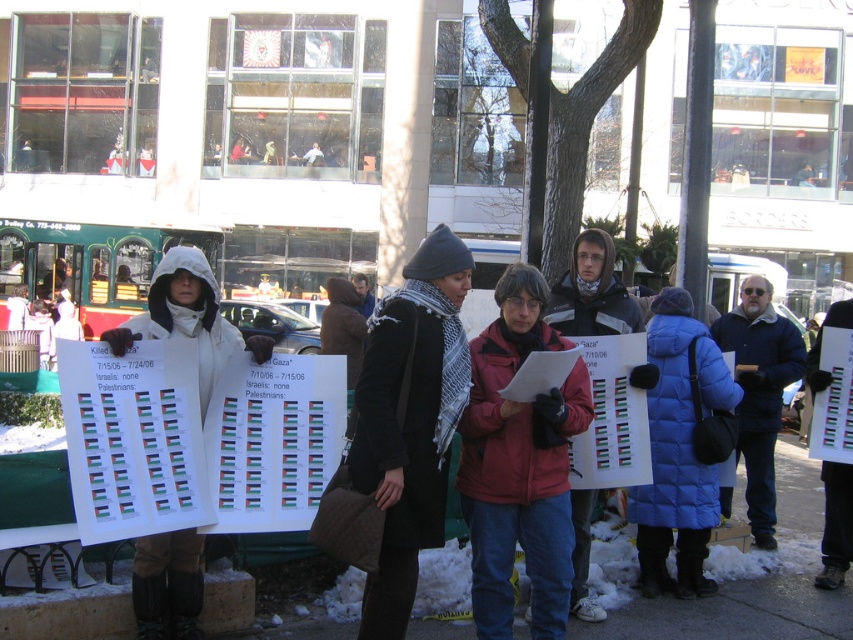
Question: Can you confirm if white fleece jacket at center is positioned above dark blue jacket at center?

Choices:
 (A) no
 (B) yes

Answer: (A)

Question: Which of the following is the farthest from the observer?

Choices:
 (A) (384, 362)
 (B) (761, 400)
 (C) (563, 273)

Answer: (B)

Question: Does dark blue jacket at center appear on the left side of white paper sign at center?

Choices:
 (A) yes
 (B) no

Answer: (A)

Question: Which point appears closest to the camera in this image?

Choices:
 (A) (848, 307)
 (B) (264, 352)
 (C) (575, 304)

Answer: (B)

Question: Can you confirm if black wool coat at center is thinner than blue woolen jacket at center-right?

Choices:
 (A) no
 (B) yes

Answer: (B)

Question: Based on their relative distances, which object is farther from the white paper sign at center?

Choices:
 (A) blue woolen jacket at center-right
 (B) dark blue jacket at center
 (C) black wool coat at center
 (D) blue down jacket at center

Answer: (C)